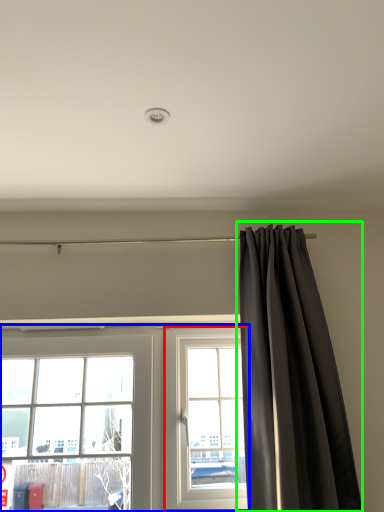
Question: Which is farther away from window (highlighted by a red box)? window (highlighted by a blue box) or curtain (highlighted by a green box)?

Choices:
 (A) window
 (B) curtain

Answer: (B)